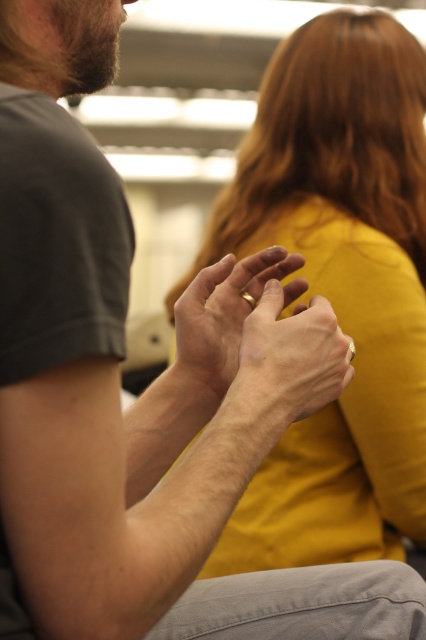
You are a jeweler examining the image. You need to determine whether the matte gold ring at center can be easily removed from the smooth skin hands at center without causing discomfort. Based on their positions, is this possible?

The smooth skin hands at center is positioned under matte gold ring at center, so the ring can be easily slid off the hand since it is above the hand.

You are a fashion designer analyzing the image to determine the placement of a new accessory. The mustard yellow fabric at upper right is positioned at point (337, 289). Where should you place a complementary accessory to balance the composition?

The mustard yellow fabric at upper right is located at point (337, 289). To balance the composition, place the complementary accessory symmetrically opposite at point 0.548, 0.207.